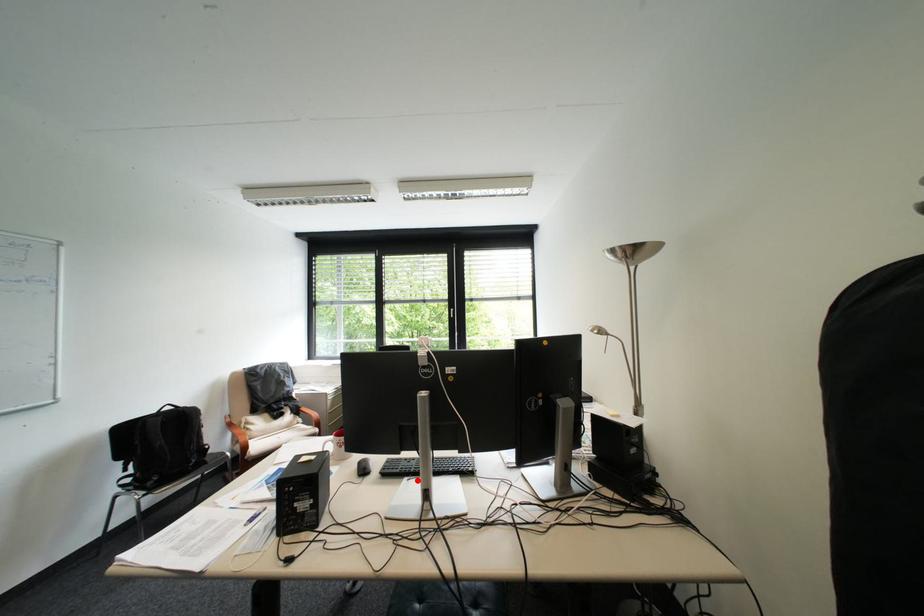
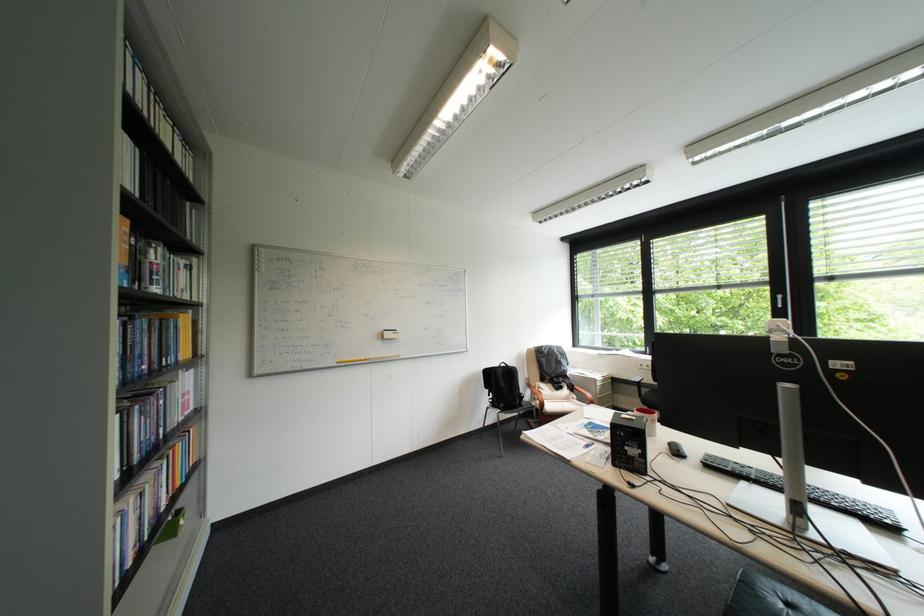
In the second image, find the point that corresponds to the highlighted location in the first image.

(757, 484)